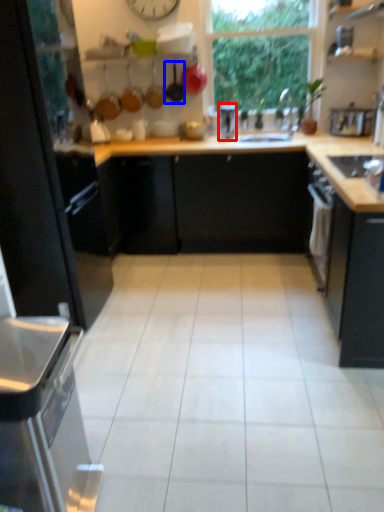
Question: Among these objects, which one is farthest to the camera, appliance (highlighted by a red box) or frying pan (highlighted by a blue box)?

Choices:
 (A) appliance
 (B) frying pan

Answer: (B)